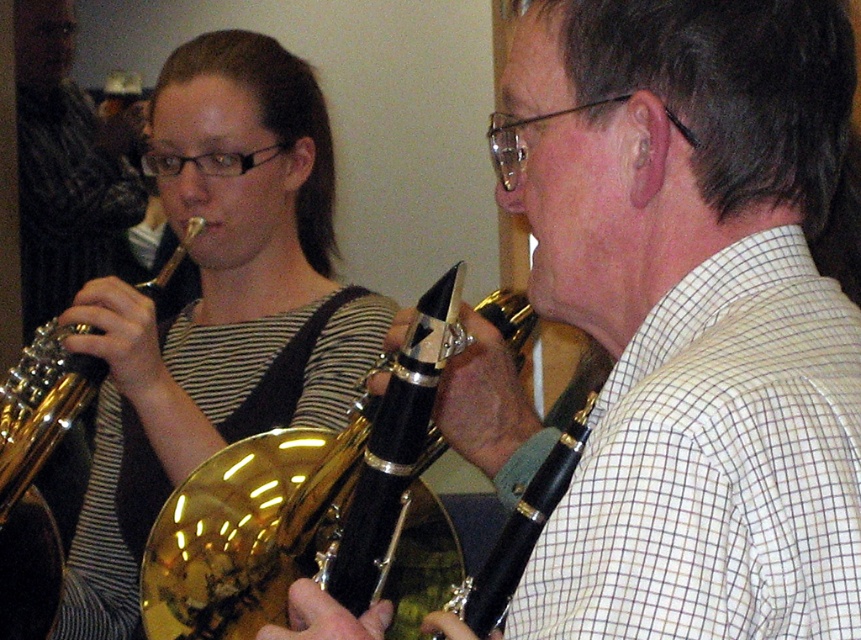
Question: Observing the image, what is the correct spatial positioning of gold shiny trumpet at center in reference to brushed metal saxophone at upper left?

Choices:
 (A) left
 (B) right

Answer: (B)

Question: Does matte black clarinet at upper left appear on the right side of brushed metal saxophone at upper left?

Choices:
 (A) yes
 (B) no

Answer: (A)

Question: Considering the real-world distances, which object is closest to the gold shiny trumpet at left?

Choices:
 (A) matte black clarinet at upper left
 (B) brushed metal saxophone at upper left

Answer: (A)

Question: Based on their relative distances, which object is farther from the brushed metal saxophone at upper left?

Choices:
 (A) gold shiny trumpet at center
 (B) matte black clarinet at upper left

Answer: (A)

Question: Can you confirm if matte black clarinet at upper left is thinner than brushed metal saxophone at upper left?

Choices:
 (A) no
 (B) yes

Answer: (A)

Question: Which of the following is the closest to the observer?

Choices:
 (A) (283, 576)
 (B) (110, 230)
 (C) (50, 392)

Answer: (A)